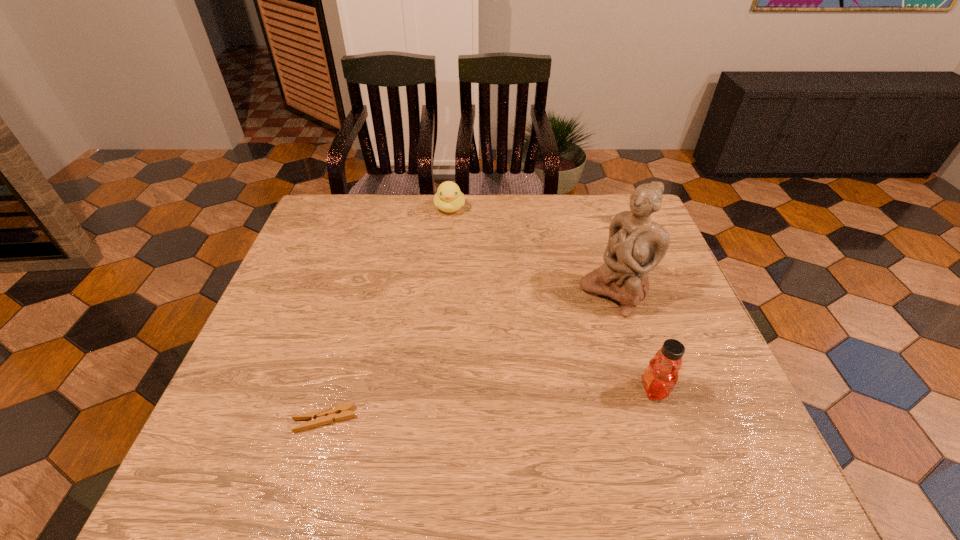
This screenshot has height=540, width=960. In order to click on vacant region between the tallest object and the second nearest object in this screenshot , I will do `click(635, 342)`.

Select which object appears as the closest to the second shortest object. Please provide its 2D coordinates. Your answer should be formatted as a tuple, i.e. [(x, y)], where the tuple contains the x and y coordinates of a point satisfying the conditions above.

[(636, 244)]

The image size is (960, 540). In order to click on object that is the closest one to the third nearest object in this screenshot , I will do `click(661, 375)`.

Where is `free space that satisfies the following two spatial constraints: 1. on the front side of the tallest object; 2. on the front label of the honey`? This screenshot has height=540, width=960. free space that satisfies the following two spatial constraints: 1. on the front side of the tallest object; 2. on the front label of the honey is located at coordinates (644, 389).